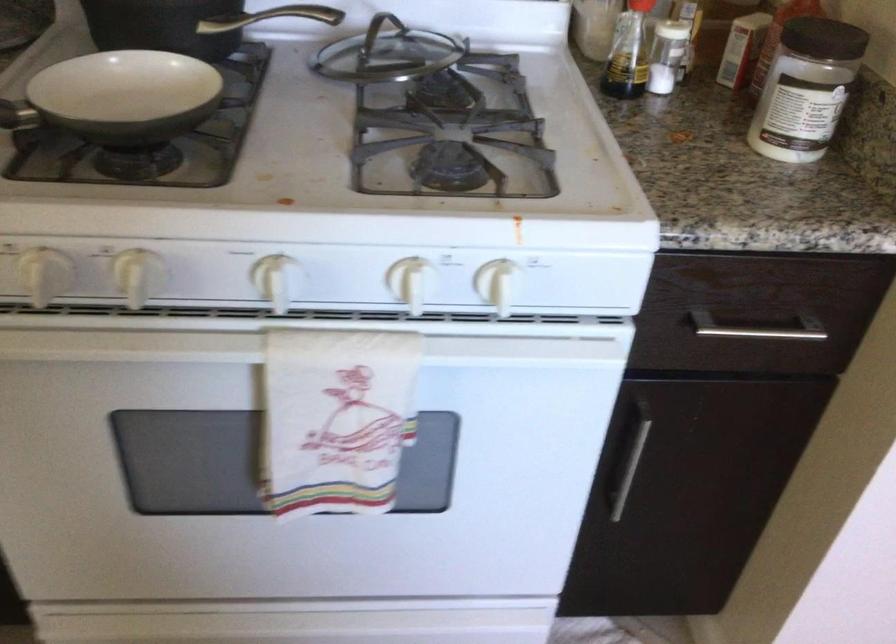
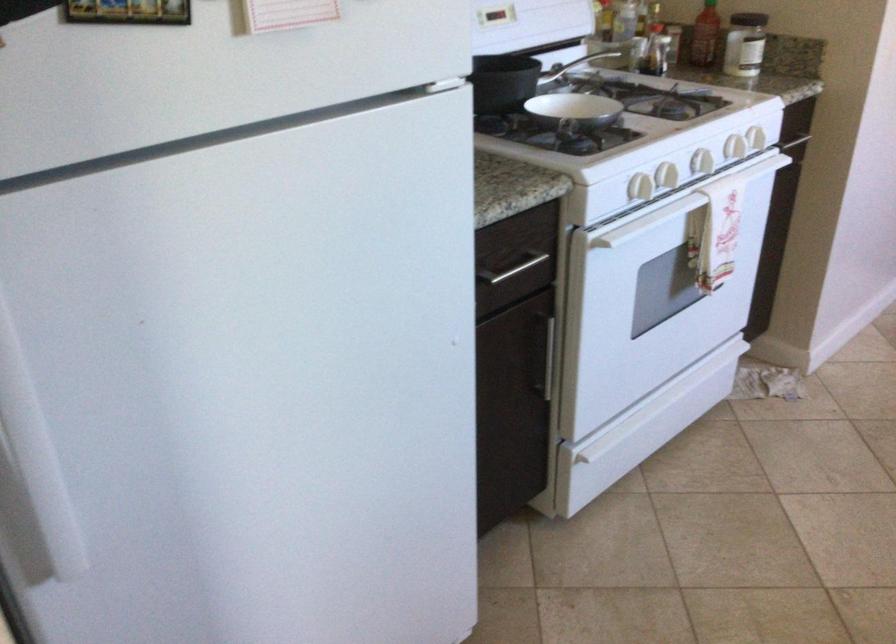
Locate, in the second image, the point that corresponds to point 184,345 in the first image.

(702, 162)